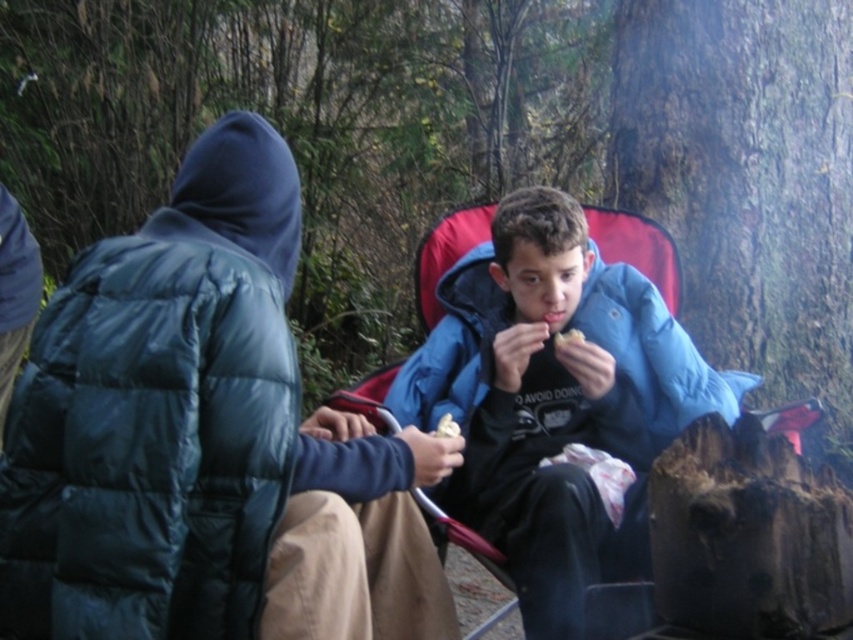
Between white crumbly bread at center and white crumbly snack at center, which one is positioned lower?

white crumbly bread at center is below.

Who is more distant from viewer, (x=451, y=435) or (x=579, y=330)?

Positioned behind is point (x=579, y=330).

The image size is (853, 640). Find the location of `white crumbly bread at center`. white crumbly bread at center is located at coordinates (445, 426).

Describe the element at coordinates (204, 440) in the screenshot. I see `dark blue puffy jacket at center` at that location.

Which is behind, point (276, 426) or point (555, 339)?

Positioned behind is point (555, 339).

Locate an element on the screen. The image size is (853, 640). dark blue puffy jacket at center is located at coordinates (204, 440).

Identify the location of dark blue puffy jacket at center. (204, 440).

How distant is dark blue puffy jacket at center from white crumbly bread at center?

dark blue puffy jacket at center and white crumbly bread at center are 27.52 inches apart.

Who is more forward, [169,632] or [444,432]?

Point [169,632] is more forward.

Image resolution: width=853 pixels, height=640 pixels. I want to click on dark blue puffy jacket at center, so click(204, 440).